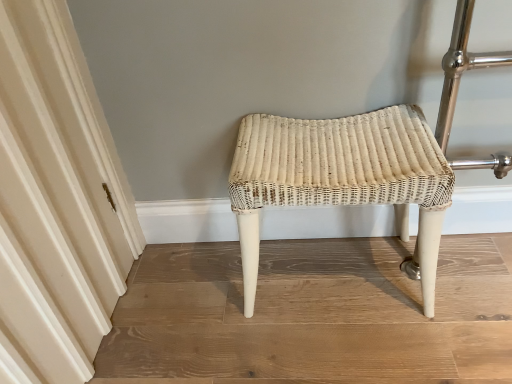
Question: In the image, is creamy white fabric at left positioned in front of or behind white wicker stool at center?

Choices:
 (A) behind
 (B) front

Answer: (B)

Question: Is creamy white fabric at left bigger or smaller than white wicker stool at center?

Choices:
 (A) big
 (B) small

Answer: (B)

Question: From a real-world perspective, relative to white wicker stool at center, is creamy white fabric at left vertically above or below?

Choices:
 (A) above
 (B) below

Answer: (A)

Question: From the image's perspective, is white wicker stool at center located above or below creamy white fabric at left?

Choices:
 (A) above
 (B) below

Answer: (B)

Question: In terms of width, does white wicker stool at center look wider or thinner when compared to creamy white fabric at left?

Choices:
 (A) wide
 (B) thin

Answer: (A)

Question: Is point (340, 140) positioned closer to the camera than point (77, 94)?

Choices:
 (A) farther
 (B) closer

Answer: (B)

Question: From a real-world perspective, is white wicker stool at center above or below creamy white fabric at left?

Choices:
 (A) above
 (B) below

Answer: (B)